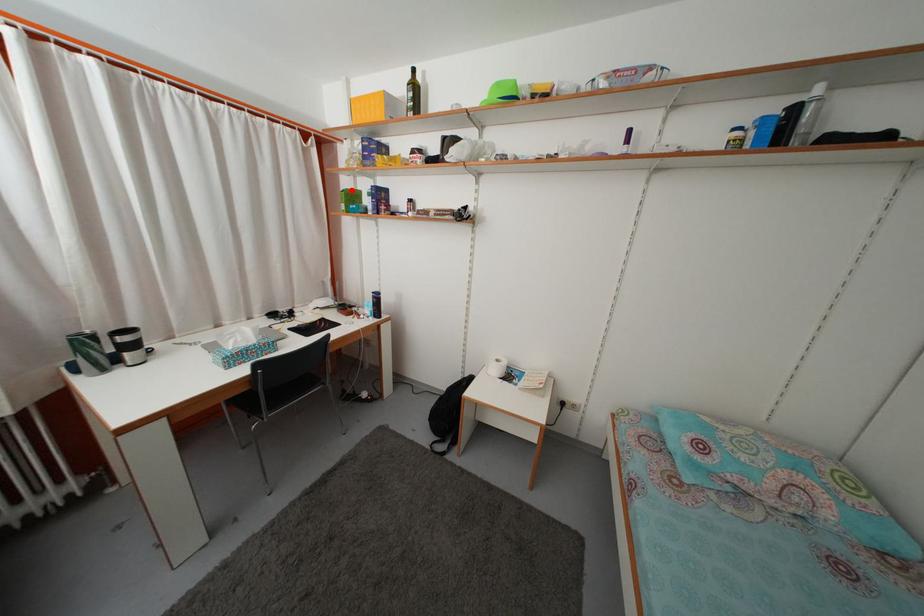
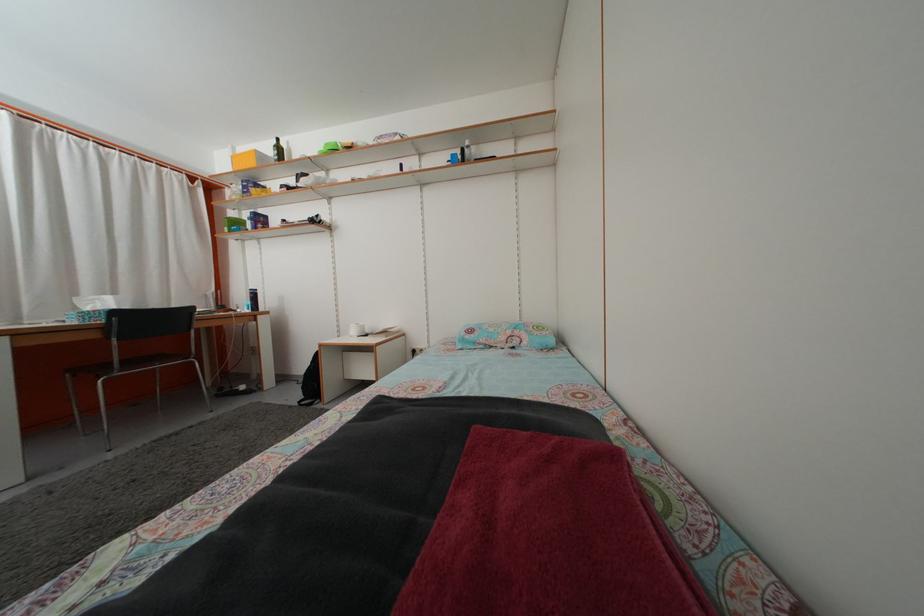
In the second image, find the point that corresponds to the highlighted location in the first image.

(237, 223)